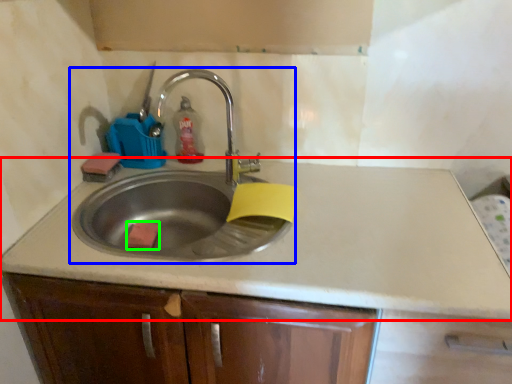
Question: Considering the real-world distances, which object is closest to countertop (highlighted by a red box)? sink (highlighted by a blue box) or soap (highlighted by a green box).

Choices:
 (A) sink
 (B) soap

Answer: (A)